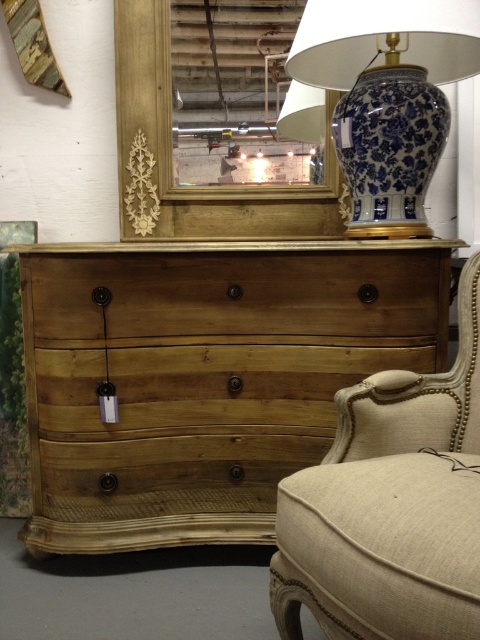
You are an interior designer planning to place a 1.2 meter wide sofa in the space between the beige fabric swivel chair at right and the natural wood drawer at center. Based on the scene, can the sofa fit in that space?

The beige fabric swivel chair at right has a lesser width compared to natural wood drawer at center. Since the sofa is 1.2 meters wide, it depends on the actual width of the space between them. However, since the chair is narrower than the drawer, the space might be sufficient. Without exact measurements, it is uncertain.

You are arranging flowers in a store and need to place a new arrangement between the blue and white porcelain vase at upper right and the blue porcelain vase at upper right. According to the scene, which vase should be on the left side of your arrangement?

The blue porcelain vase at upper right should be on the left side of your arrangement because the blue and white porcelain vase at upper right is positioned to its right.